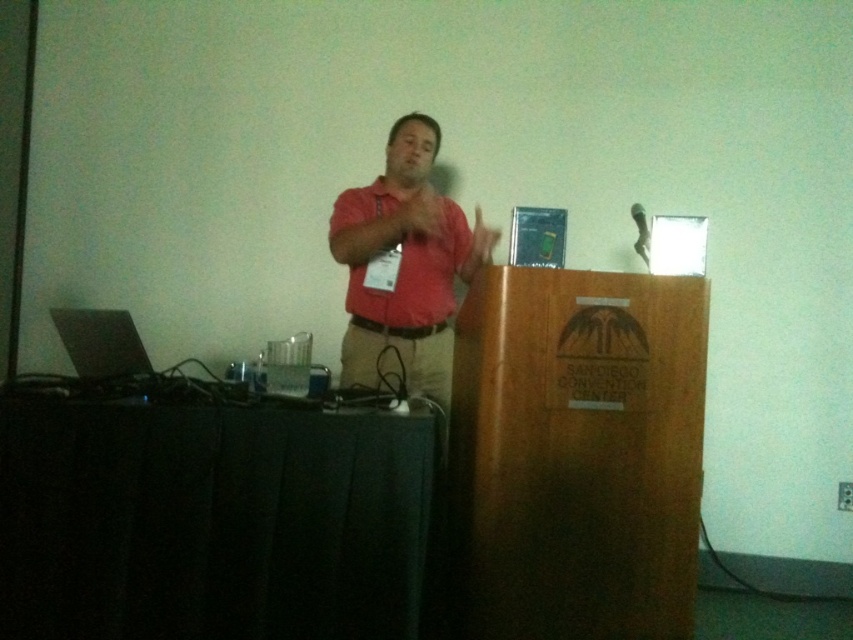
You are attending a conference and notice a speaker at the podium. You see a matte pink shirt at center and a matte pink hand at center. Which object is located to the left of the other?

The matte pink shirt at center is positioned on the left side of matte pink hand at center.